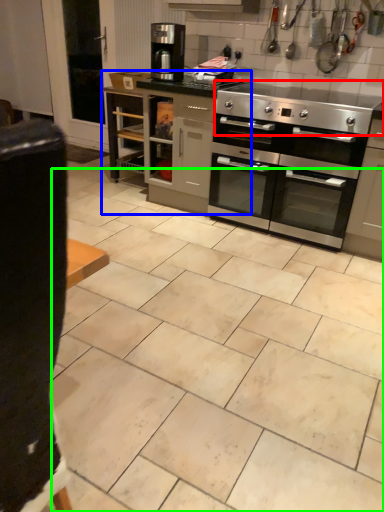
Question: Considering the real-world distances, which object is closest to gas stove (highlighted by a red box)? cabinetry (highlighted by a blue box) or ceramic tile (highlighted by a green box).

Choices:
 (A) cabinetry
 (B) ceramic tile

Answer: (A)